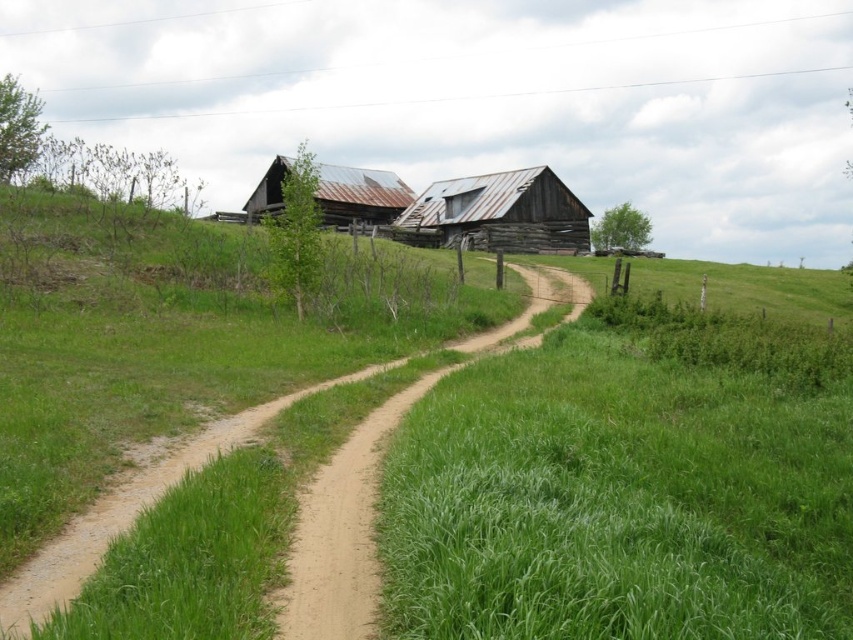
You are standing at the bottom left corner of the image and want to walk to the point labeled point [560,225]. However, there is an obstacle at point labeled point [822,504]. Will you encounter this obstacle before reaching your destination?

Yes, you will encounter the obstacle at point [822,504] before reaching point [560,225] because point [822,504] is closer to the camera than point [560,225].

You are planning to set up a tent in the green grassy at center near the weathered wood hut at center. Considering their relative heights, which one is taller?

The weathered wood hut at center is taller than the green grassy at center.

You are a farmer driving a tractor that is 3 meters wide. You need to pass through the path between the green grassy at center and the rusty metal barn at center. Can your tractor fit through the path?

The green grassy at center is narrower than the rusty metal barn at center, but the exact width isn t specified. Since the tractor is 3 meters wide, we cannot determine if the path is wide enough without more information.